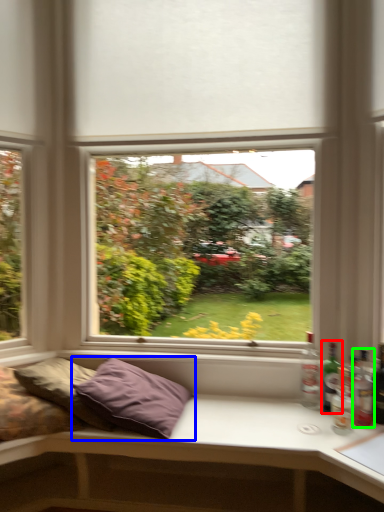
Question: Considering the real-world distances, which object is closest to bottle (highlighted by a red box)? pillow (highlighted by a blue box) or bottle (highlighted by a green box).

Choices:
 (A) pillow
 (B) bottle

Answer: (B)